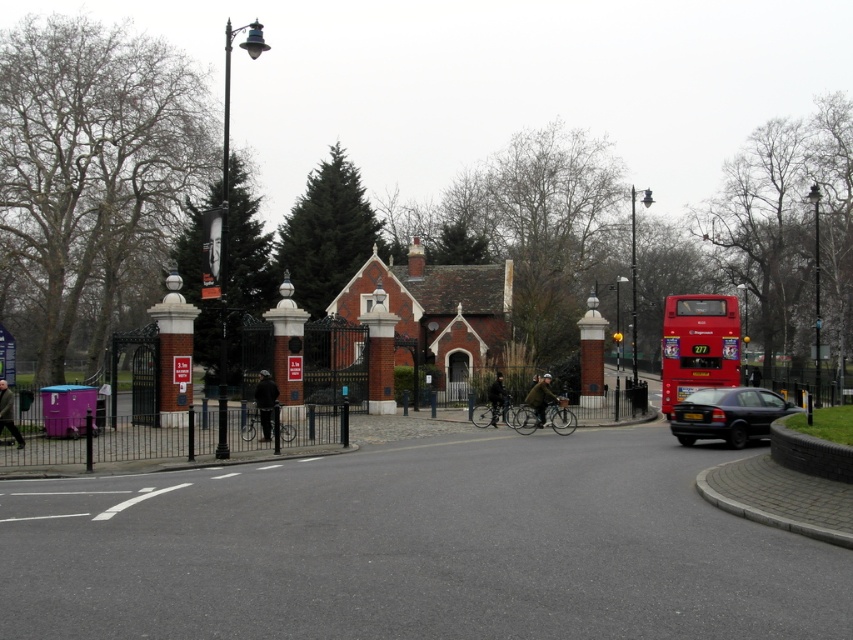
Locate an element on the screen. Image resolution: width=853 pixels, height=640 pixels. red metallic bus at right is located at coordinates (698, 346).

Is red metallic bus at right thinner than black matte sedan at lower right?

Incorrect, red metallic bus at right's width is not less than black matte sedan at lower right's.

Image resolution: width=853 pixels, height=640 pixels. What are the coordinates of `red metallic bus at right` in the screenshot? It's located at (698, 346).